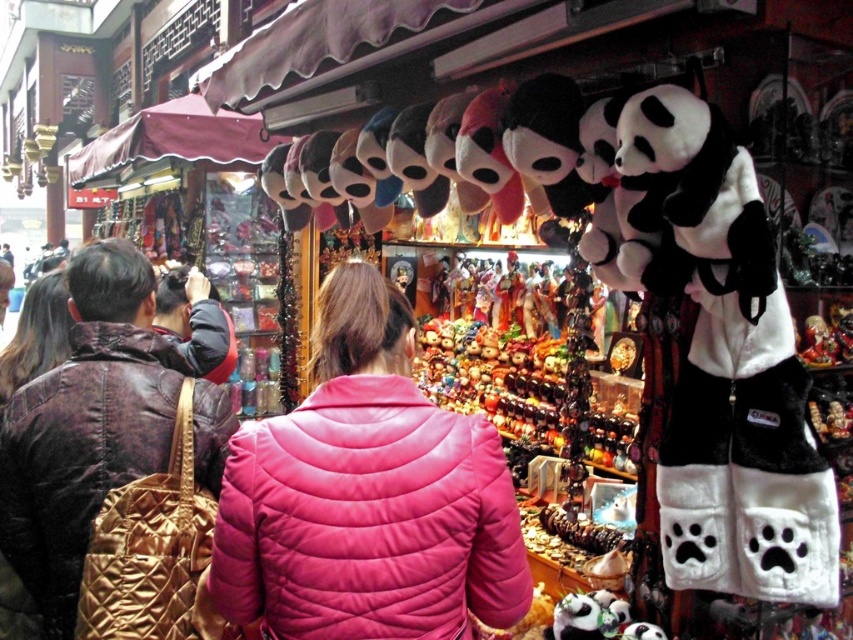
Question: Can you confirm if pink quilted jacket at center is positioned to the right of matte brown leather jacket at left?

Choices:
 (A) yes
 (B) no

Answer: (A)

Question: Does pink quilted jacket at center appear on the left side of leather jacket at left?

Choices:
 (A) no
 (B) yes

Answer: (A)

Question: Does pink quilted jacket at center have a greater width compared to matte brown leather jacket at left?

Choices:
 (A) yes
 (B) no

Answer: (A)

Question: Estimate the real-world distances between objects in this image. Which object is closer to the leather jacket at left?

Choices:
 (A) pink quilted jacket at center
 (B) matte brown leather jacket at left

Answer: (B)

Question: Which object is farther from the camera taking this photo?

Choices:
 (A) leather jacket at left
 (B) pink quilted jacket at center

Answer: (A)

Question: Among these objects, which one is nearest to the camera?

Choices:
 (A) matte brown leather jacket at left
 (B) leather jacket at left

Answer: (B)